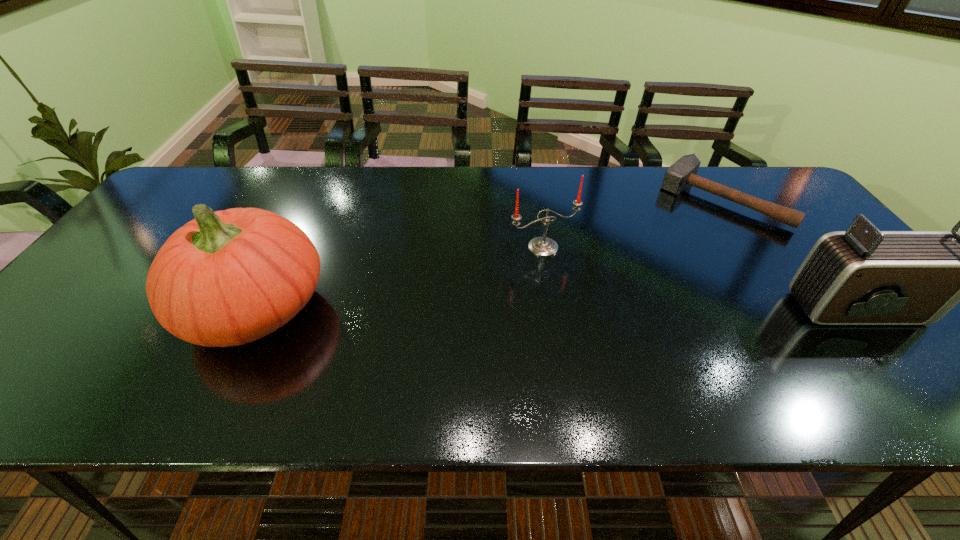
The image size is (960, 540). I want to click on vacant space at the far right corner of the desktop, so click(732, 176).

The width and height of the screenshot is (960, 540). I want to click on vacant point located between the pumpkin and the second object from left to right, so click(399, 278).

Find the location of a particular element. Image resolution: width=960 pixels, height=540 pixels. vacant region between the second farthest object and the leftmost object is located at coordinates (399, 278).

Where is `empty location between the hammer and the third nearest object`? The image size is (960, 540). empty location between the hammer and the third nearest object is located at coordinates (632, 224).

Identify which object is the third closest to the leftmost object. Please provide its 2D coordinates. Your answer should be formatted as a tuple, i.e. [(x, y)], where the tuple contains the x and y coordinates of a point satisfying the conditions above.

[(855, 277)]

Identify which object is the second closest to the camcorder. Please provide its 2D coordinates. Your answer should be formatted as a tuple, i.e. [(x, y)], where the tuple contains the x and y coordinates of a point satisfying the conditions above.

[(543, 246)]

Where is `free space that satisfies the following two spatial constraints: 1. on the back side of the shortest object; 2. on the right side of the third nearest object`? free space that satisfies the following two spatial constraints: 1. on the back side of the shortest object; 2. on the right side of the third nearest object is located at coordinates (536, 201).